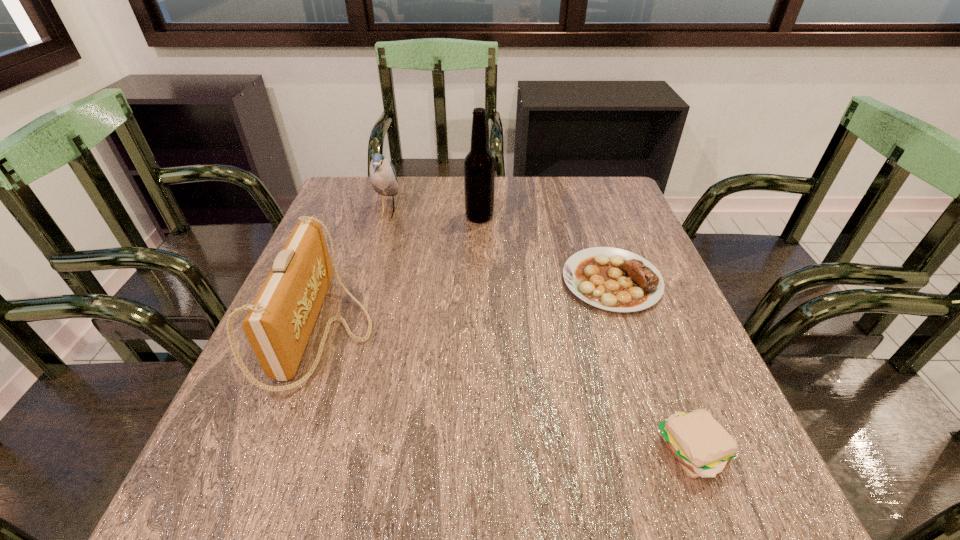
Where is `free space that is in between the shortest object and the third object from left to right`? The image size is (960, 540). free space that is in between the shortest object and the third object from left to right is located at coordinates (545, 249).

Identify the location of vacant space that is in between the bird and the fourth tallest object. The image size is (960, 540). (540, 332).

The height and width of the screenshot is (540, 960). I want to click on unoccupied area between the bird and the second shortest object, so click(540, 332).

The image size is (960, 540). I want to click on free space between the shortest object and the tallest object, so click(545, 249).

The height and width of the screenshot is (540, 960). In order to click on unoccupied area between the handbag and the shortest object in this screenshot , I will do `click(468, 306)`.

This screenshot has height=540, width=960. I want to click on vacant space in between the steak and the beer bottle, so click(545, 249).

You are a GUI agent. You are given a task and a screenshot of the screen. Output one action in this format:
    pyautogui.click(x=<x>, y=<y>)
    Task: Click on the vacant point located between the patty and the bird
    
    Given the screenshot: What is the action you would take?
    pyautogui.click(x=540, y=332)

Select which object is the closest to the beer bottle. Please provide its 2D coordinates. Your answer should be formatted as a tuple, i.e. [(x, y)], where the tuple contains the x and y coordinates of a point satisfying the conditions above.

[(383, 178)]

At what (x,y) coordinates should I click in order to perform the action: click on the second closest object to the shortest object. Please return your answer as a coordinate pair (x, y). The image size is (960, 540). Looking at the image, I should click on (701, 445).

The height and width of the screenshot is (540, 960). In order to click on vacant position in the image that satisfies the following two spatial constraints: 1. at the tip of the bird's beak; 2. on the back side of the shortest object in this screenshot , I will do `click(369, 281)`.